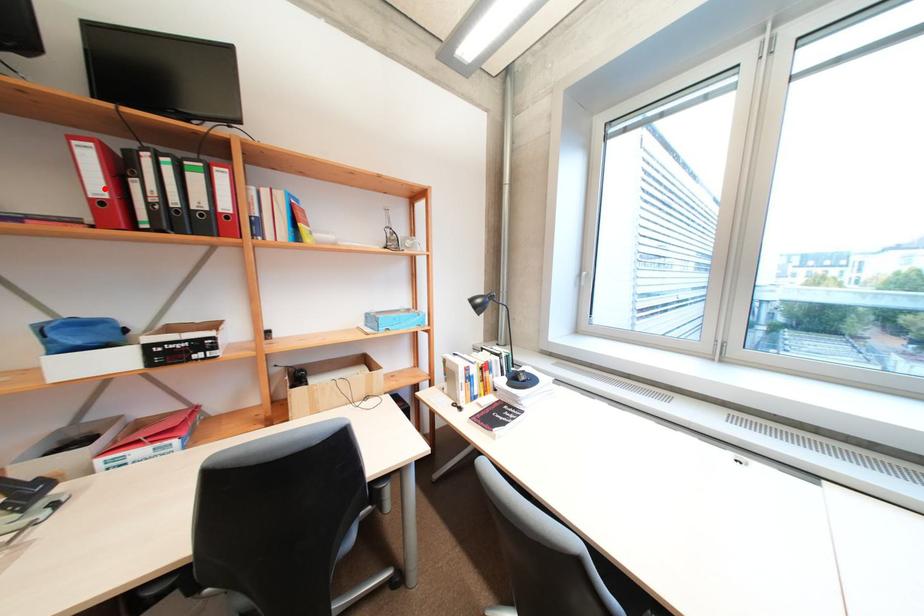
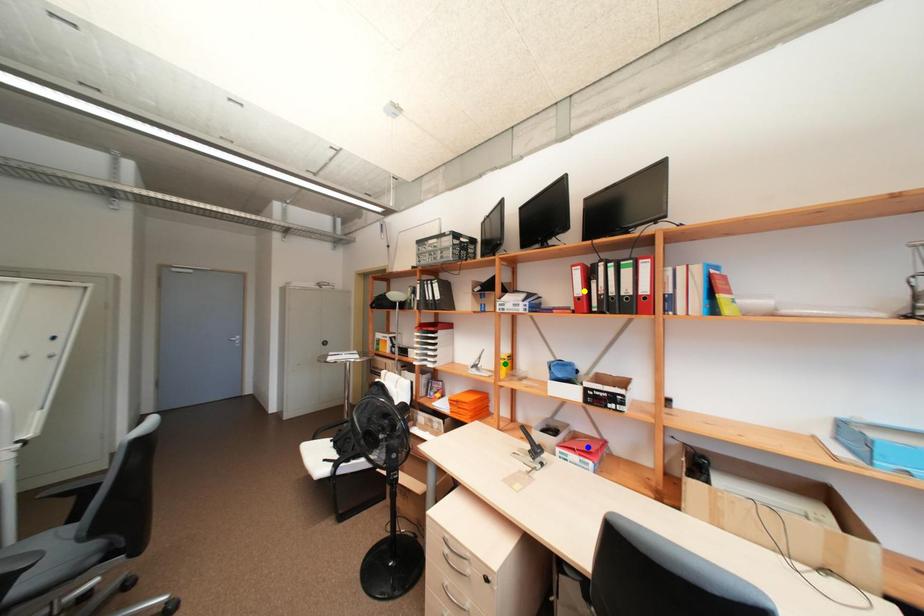
Question: I am providing you with two images of the same scene from different viewpoints. A red point is marked on the first image. You are given multiple points on the second image. Can you choose the point in image 2 that corresponds to the point in image 1?

Choices:
 (A) blue point
 (B) green point
 (C) yellow point

Answer: (C)